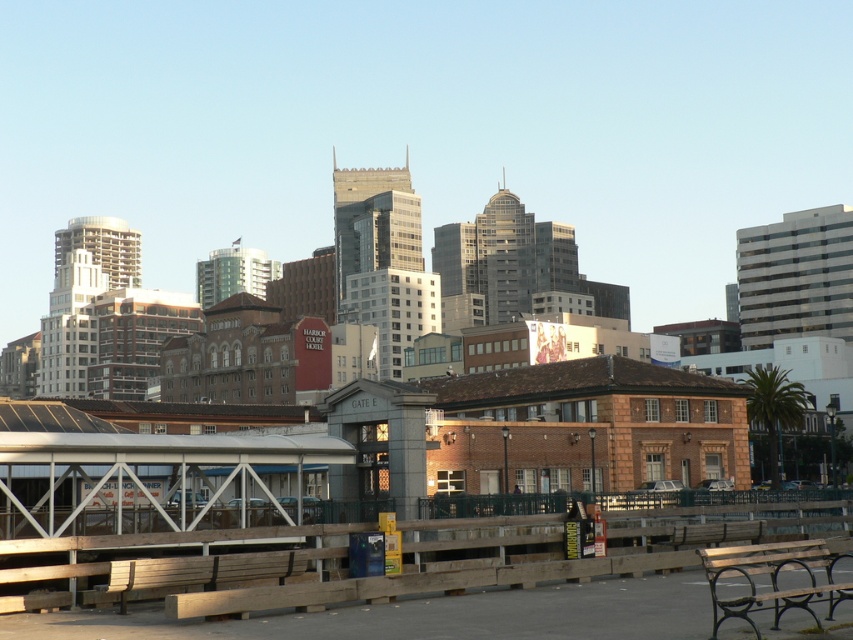
Question: In this image, where is wooden bench at lower right located relative to wooden bench at lower left?

Choices:
 (A) above
 (B) below

Answer: (B)

Question: Is wooden bench at lower right positioned before wooden bench at lower left?

Choices:
 (A) no
 (B) yes

Answer: (B)

Question: Among these objects, which one is nearest to the camera?

Choices:
 (A) wooden bench at lower right
 (B) wooden bench at lower left

Answer: (A)

Question: Can you confirm if wooden bench at lower right is thinner than wooden bench at lower left?

Choices:
 (A) yes
 (B) no

Answer: (B)

Question: Among these objects, which one is farthest from the camera?

Choices:
 (A) wooden bench at lower right
 (B) wooden bench at lower left

Answer: (B)